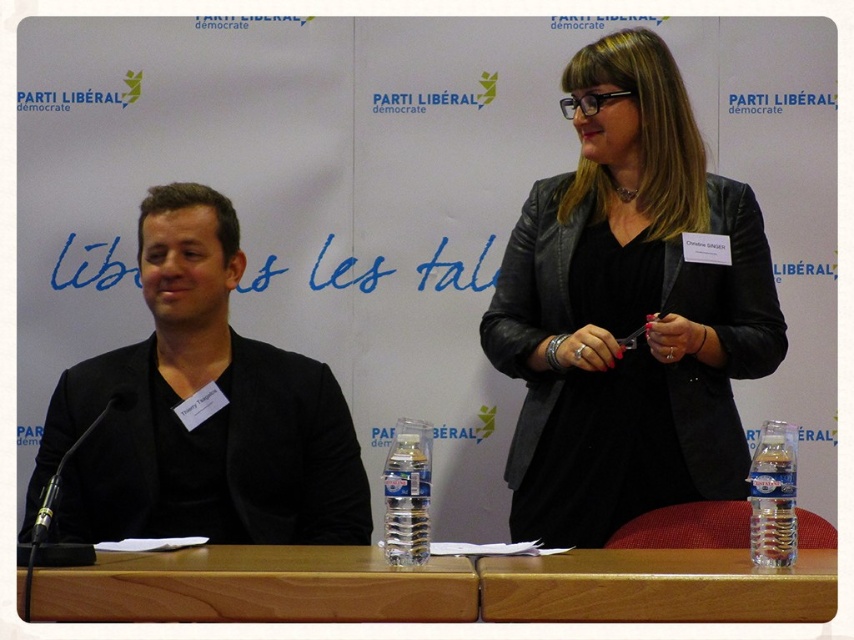
Question: Which point is farther from the camera taking this photo?

Choices:
 (A) (414, 531)
 (B) (673, 97)

Answer: (B)

Question: Does wooden at lower center appear under clear plastic bottle at center?

Choices:
 (A) yes
 (B) no

Answer: (A)

Question: Can you confirm if wooden table at center is bigger than clear plastic bottle at center?

Choices:
 (A) yes
 (B) no

Answer: (A)

Question: Can you confirm if wooden table at center is bigger than clear plastic bottle at lower right?

Choices:
 (A) no
 (B) yes

Answer: (B)

Question: Which object appears farthest from the camera in this image?

Choices:
 (A) clear plastic bottle at lower right
 (B) clear plastic bottle at center

Answer: (A)

Question: Which object is closer to the camera taking this photo?

Choices:
 (A) black matte jacket at left
 (B) clear plastic bottle at center
 (C) wooden at lower center

Answer: (C)